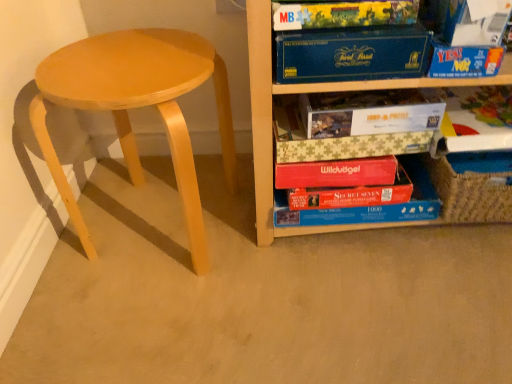
Find the location of `free spot in front of red cardboard puzzle box at lower center, the second book positioned from the right`. free spot in front of red cardboard puzzle box at lower center, the second book positioned from the right is located at coordinates (368, 292).